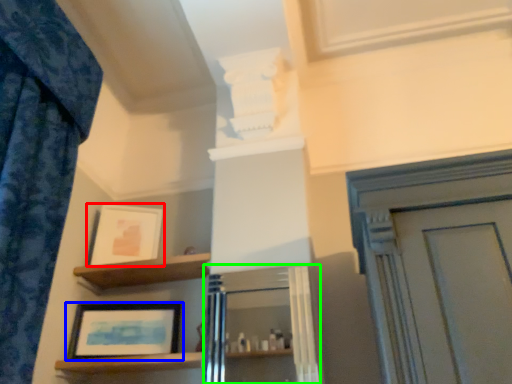
Question: Considering the real-world distances, which object is farthest from picture frame (highlighted by a red box)? picture frame (highlighted by a blue box) or cabinetry (highlighted by a green box)?

Choices:
 (A) picture frame
 (B) cabinetry

Answer: (B)